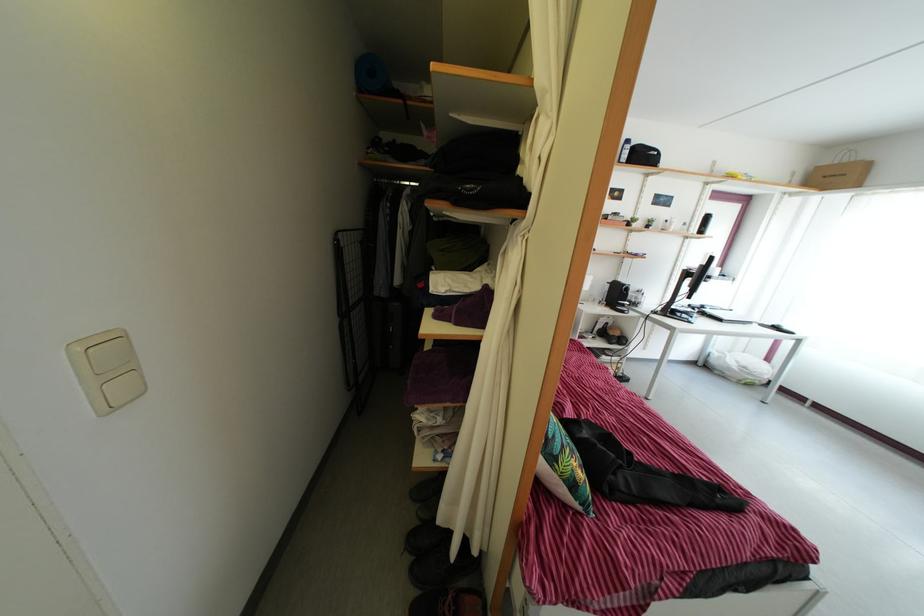
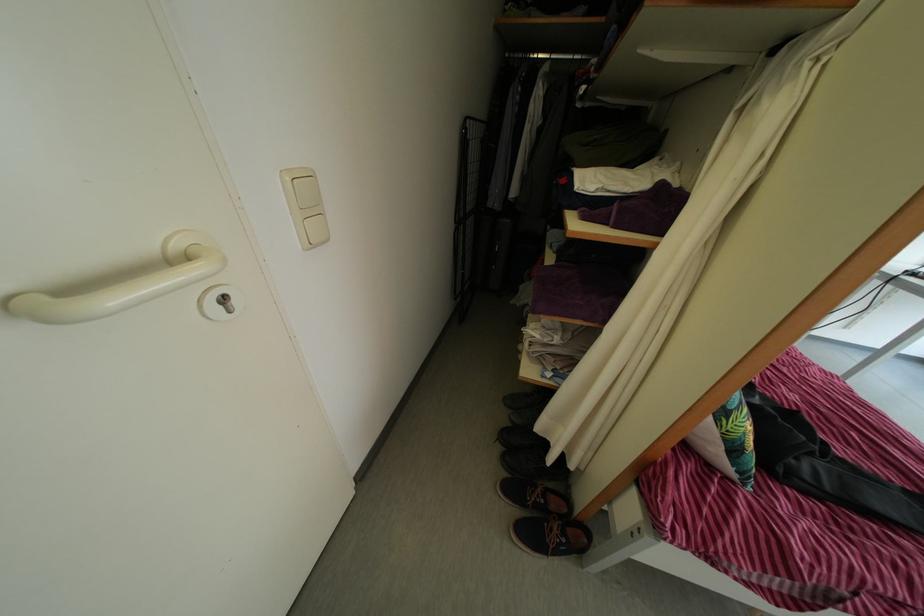
Find the pixel in the second image that matches the point at 86,358 in the first image.

(295, 187)